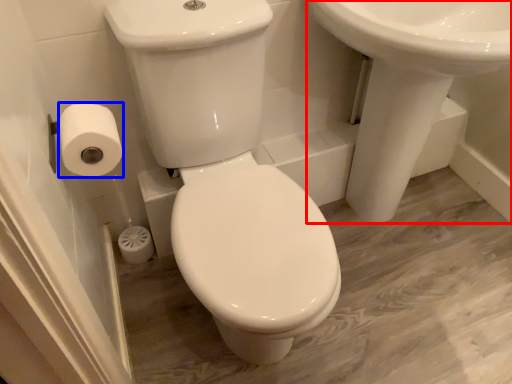
Question: Which of the following is the closest to the observer, sink (highlighted by a red box) or toilet paper (highlighted by a blue box)?

Choices:
 (A) sink
 (B) toilet paper

Answer: (A)